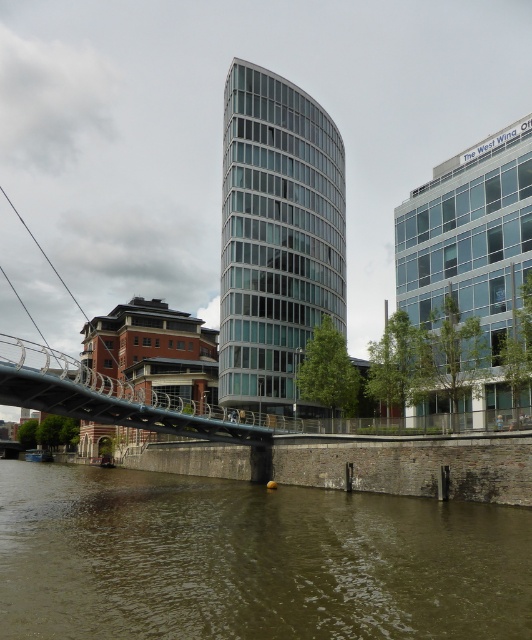
Question: Which object appears closest to the camera in this image?

Choices:
 (A) metallic gray bridge at center
 (B) brown concrete river at lower center

Answer: (B)

Question: Which object appears closest to the camera in this image?

Choices:
 (A) metallic gray bridge at center
 (B) clear glass building at center

Answer: (A)

Question: Is the position of clear glass building at center more distant than that of metallic gray bridge at center?

Choices:
 (A) no
 (B) yes

Answer: (B)

Question: Can you confirm if brown concrete river at lower center is thinner than metallic gray bridge at center?

Choices:
 (A) no
 (B) yes

Answer: (A)

Question: Does clear glass building at center appear on the right side of metallic gray bridge at center?

Choices:
 (A) no
 (B) yes

Answer: (B)

Question: Among these points, which one is farthest from the camera?

Choices:
 (A) (304, 305)
 (B) (314, 577)
 (C) (103, 404)

Answer: (A)